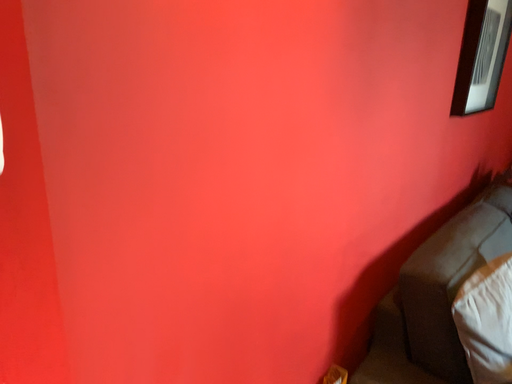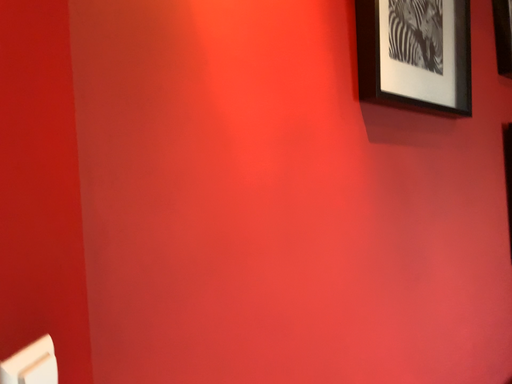
Question: How did the camera likely rotate when shooting the video?

Choices:
 (A) rotated upward
 (B) rotated downward

Answer: (A)